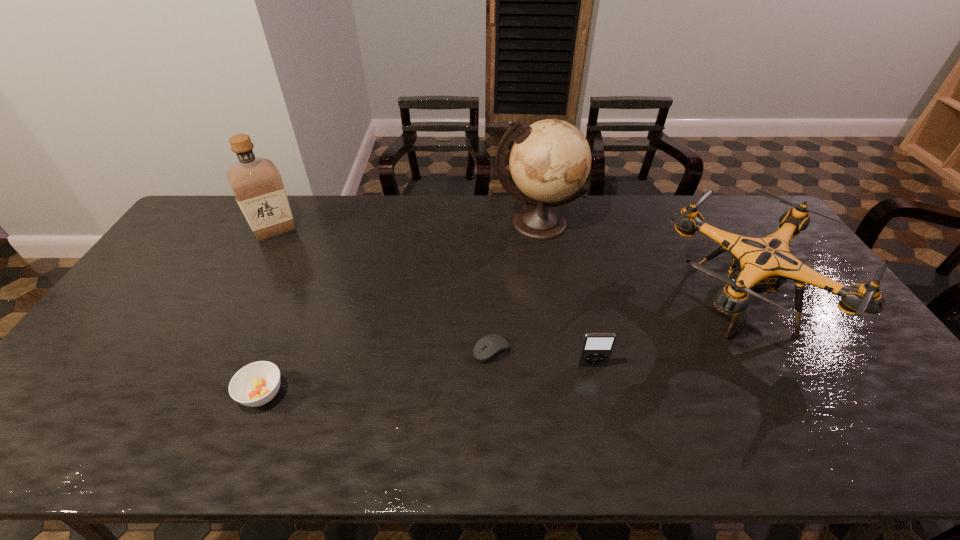
The height and width of the screenshot is (540, 960). I want to click on free space located 0.060m on the camera mount of the rightmost object, so click(635, 301).

Locate an element on the screen. The height and width of the screenshot is (540, 960). vacant space located 0.270m on the camera mount of the rightmost object is located at coordinates (564, 301).

Locate an element on the screen. This screenshot has width=960, height=540. free space located 0.070m on the camera mount of the rightmost object is located at coordinates (632, 301).

Locate an element on the screen. This screenshot has height=540, width=960. free space located on the front-facing side of the third shortest object is located at coordinates (612, 456).

Identify the location of free space located 0.190m on the back of the second object from left to right. Image resolution: width=960 pixels, height=540 pixels. tap(293, 317).

Identify the location of free region located 0.320m on the back of the shortest object. The width and height of the screenshot is (960, 540). (490, 260).

Where is `globe at the far edge`? globe at the far edge is located at coordinates (550, 160).

Where is `liquor that is at the far edge`? The width and height of the screenshot is (960, 540). liquor that is at the far edge is located at coordinates (256, 183).

Locate an element on the screen. Image resolution: width=960 pixels, height=540 pixels. object situated at the right edge is located at coordinates (760, 265).

You are a GUI agent. You are given a task and a screenshot of the screen. Output one action in this format:
    pyautogui.click(x=<x>, y=<y>)
    Task: Click on the vacant space at the far edge of the desktop
    This screenshot has width=960, height=540.
    Given the screenshot: What is the action you would take?
    pyautogui.click(x=356, y=227)